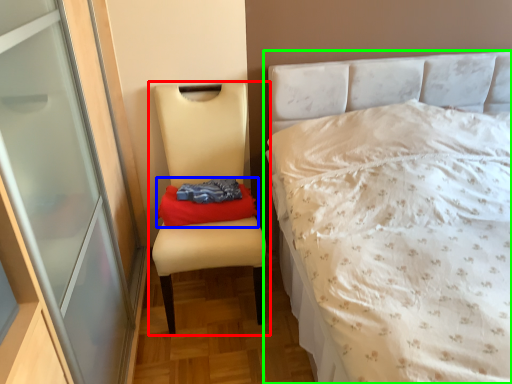
Question: Which object is positioned closest to chair (highlighted by a red box)? Select from material (highlighted by a blue box) and bed (highlighted by a green box).

Choices:
 (A) material
 (B) bed

Answer: (A)